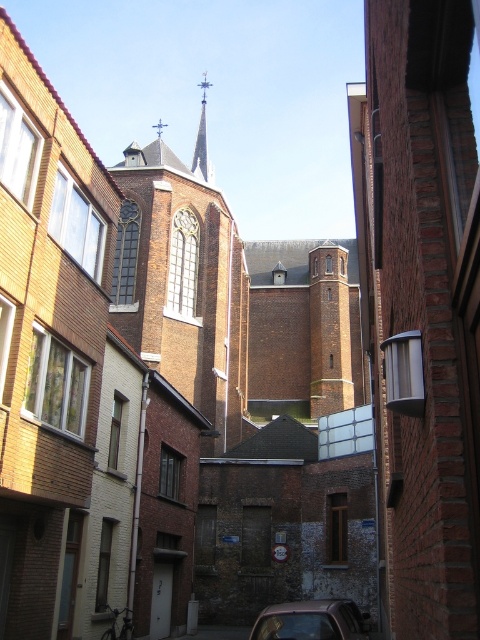
Is metallic silver car at center wider than smooth gray spire at center?

No, metallic silver car at center is not wider than smooth gray spire at center.

Which is in front, point (348, 637) or point (207, 161)?

Point (348, 637)

At what (x,y) coordinates should I click in order to perform the action: click on metallic silver car at center. Please return your answer as a coordinate pair (x, y). This screenshot has height=640, width=480. Looking at the image, I should click on point(310,620).